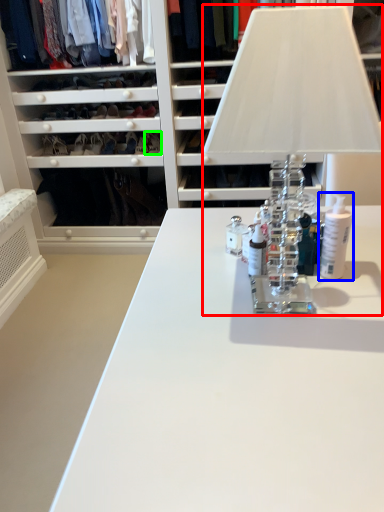
Question: Which object is positioned closest to table lamp (highlighted by a red box)? Select from toiletry (highlighted by a blue box) and shoe (highlighted by a green box).

Choices:
 (A) toiletry
 (B) shoe

Answer: (A)